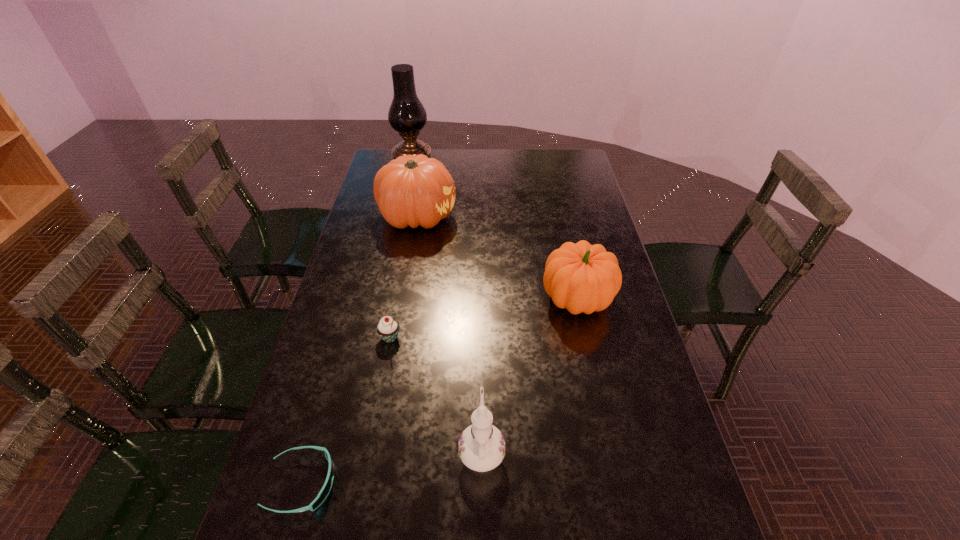
The height and width of the screenshot is (540, 960). Identify the location of oil lamp. (407, 115).

The width and height of the screenshot is (960, 540). Find the location of `the tallest object`. the tallest object is located at coordinates 407,115.

You are a GUI agent. You are given a task and a screenshot of the screen. Output one action in this format:
    pyautogui.click(x=<x>, y=<y>)
    Task: Click on the left pumpkin
    This screenshot has height=540, width=960.
    Given the screenshot: What is the action you would take?
    pyautogui.click(x=412, y=190)

The image size is (960, 540). What are the coordinates of `the second farthest object` in the screenshot? It's located at (412, 190).

This screenshot has width=960, height=540. I want to click on the second object from right to left, so click(x=481, y=447).

Where is `the right pumpkin`? The height and width of the screenshot is (540, 960). the right pumpkin is located at coordinates (581, 277).

Locate an element on the screen. This screenshot has width=960, height=540. the nearer pumpkin is located at coordinates (581, 277).

Find the location of a particular element. The height and width of the screenshot is (540, 960). the fifth tallest object is located at coordinates (388, 328).

This screenshot has height=540, width=960. I want to click on the third nearest object, so click(388, 328).

Find the location of a particular element. The height and width of the screenshot is (540, 960). the shortest object is located at coordinates (326, 488).